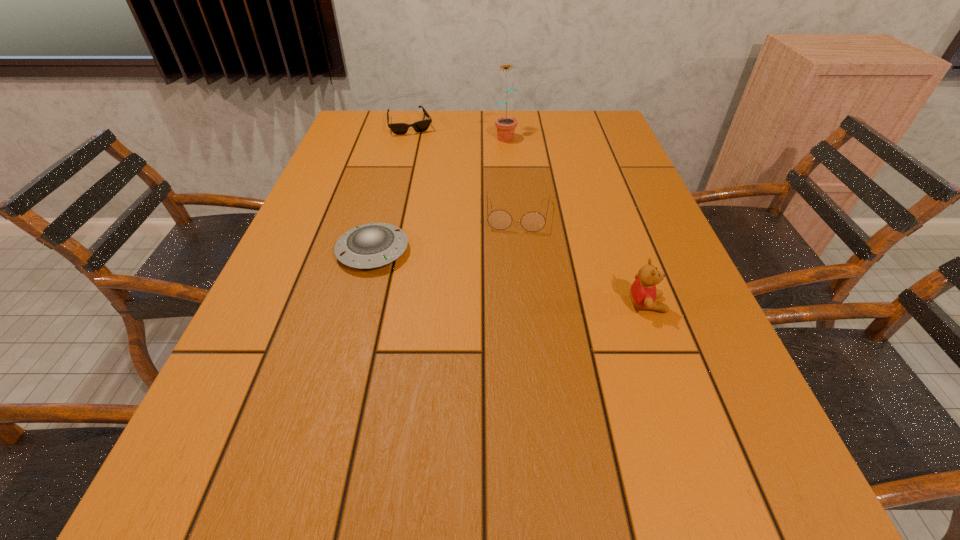
At what (x,y) coordinates should I click in order to perform the action: click on free space that is in between the teddy bear and the saucer. Please return your answer as a coordinate pair (x, y). This screenshot has height=540, width=960. Looking at the image, I should click on (510, 278).

This screenshot has height=540, width=960. I want to click on vacant area that lies between the sunglasses and the saucer, so click(392, 188).

At what (x,y) coordinates should I click in order to perform the action: click on vacant region between the sunflower and the third shortest object. Please return your answer as a coordinate pair (x, y). This screenshot has width=960, height=540. Looking at the image, I should click on (512, 175).

Where is `vacant area that lies between the third shortest object and the saucer`? This screenshot has height=540, width=960. vacant area that lies between the third shortest object and the saucer is located at coordinates (446, 233).

Where is `free point between the sunglasses and the spectacles`? free point between the sunglasses and the spectacles is located at coordinates (465, 170).

The width and height of the screenshot is (960, 540). In order to click on vacant space that is in between the tallest object and the teddy bear in this screenshot , I will do `click(576, 220)`.

Where is `free space between the saucer and the second tallest object`? The image size is (960, 540). free space between the saucer and the second tallest object is located at coordinates (510, 278).

Point out which object is positioned as the second nearest to the sunglasses. Please provide its 2D coordinates. Your answer should be formatted as a tuple, i.e. [(x, y)], where the tuple contains the x and y coordinates of a point satisfying the conditions above.

[(498, 219)]

Select which object appears as the fourth closest to the saucer. Please provide its 2D coordinates. Your answer should be formatted as a tuple, i.e. [(x, y)], where the tuple contains the x and y coordinates of a point satisfying the conditions above.

[(420, 126)]

I want to click on free region that satisfies the following two spatial constraints: 1. on the front side of the nearest object; 2. on the front-facing side of the spectacles, so click(529, 304).